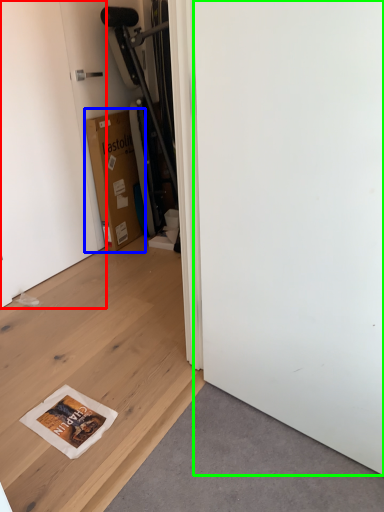
Question: Based on their relative distances, which object is nearer to door (highlighted by a red box)? Choose from cardboard box (highlighted by a blue box) and screen door (highlighted by a green box).

Choices:
 (A) cardboard box
 (B) screen door

Answer: (A)